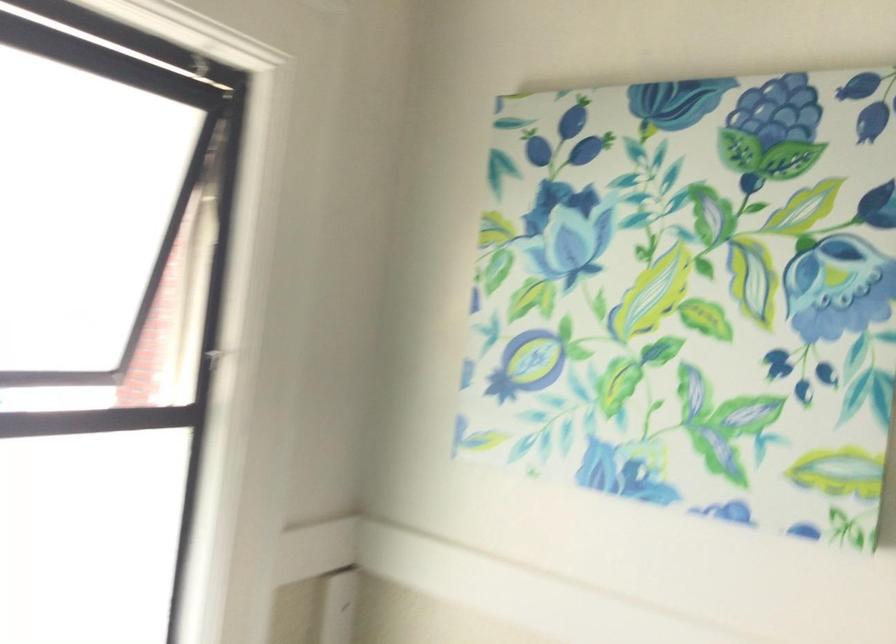
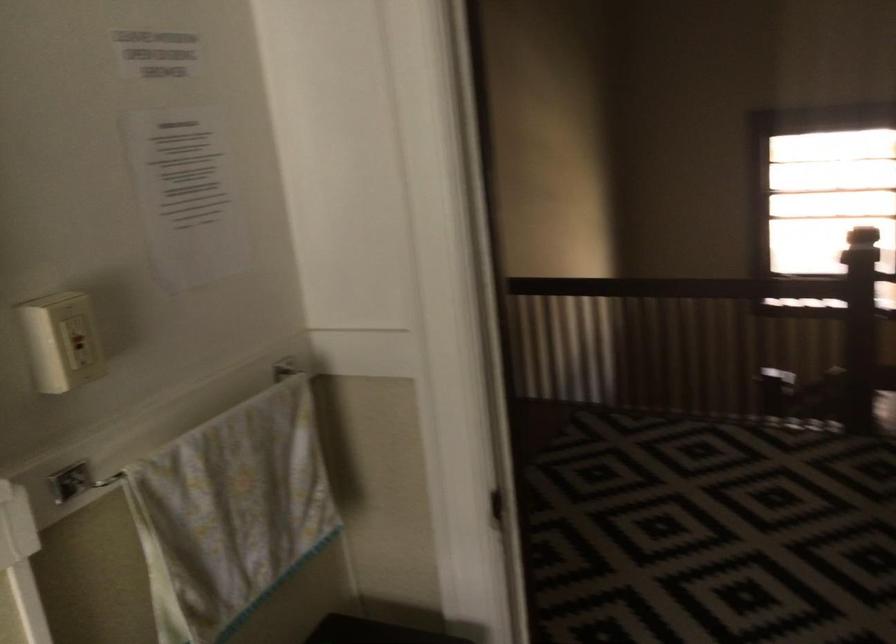
How did the camera likely rotate?

The camera rotated toward right-down.